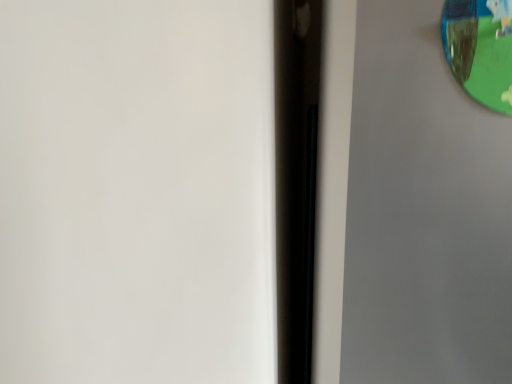
Question: From the image's perspective, is green plastic view mirror at upper right located above or below transparent plastic screen door at upper right?

Choices:
 (A) below
 (B) above

Answer: (B)

Question: Would you say green plastic view mirror at upper right is inside or outside transparent plastic screen door at upper right?

Choices:
 (A) inside
 (B) outside

Answer: (A)

Question: Is green plastic view mirror at upper right wider or thinner than transparent plastic screen door at upper right?

Choices:
 (A) wide
 (B) thin

Answer: (B)

Question: From their relative heights in the image, would you say transparent plastic screen door at upper right is taller or shorter than green plastic view mirror at upper right?

Choices:
 (A) short
 (B) tall

Answer: (B)

Question: From a real-world perspective, relative to green plastic view mirror at upper right, is transparent plastic screen door at upper right vertically above or below?

Choices:
 (A) above
 (B) below

Answer: (B)

Question: Is transparent plastic screen door at upper right wider or thinner than green plastic view mirror at upper right?

Choices:
 (A) wide
 (B) thin

Answer: (A)

Question: From the image's perspective, is transparent plastic screen door at upper right positioned above or below green plastic view mirror at upper right?

Choices:
 (A) below
 (B) above

Answer: (A)